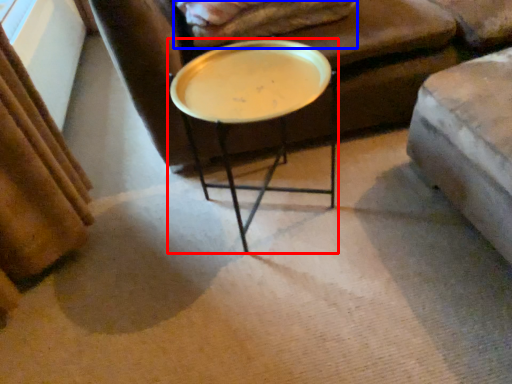
Question: Among these objects, which one is nearest to the camera, coffee table (highlighted by a red box) or blanket (highlighted by a blue box)?

Choices:
 (A) coffee table
 (B) blanket

Answer: (A)